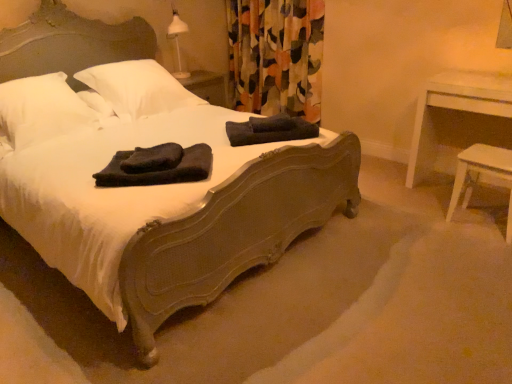
Find the location of a particular element. This screenshot has width=512, height=384. free space above black towel at center, positioned as the second material in back-to-front order (from a real-world perspective) is located at coordinates (153, 160).